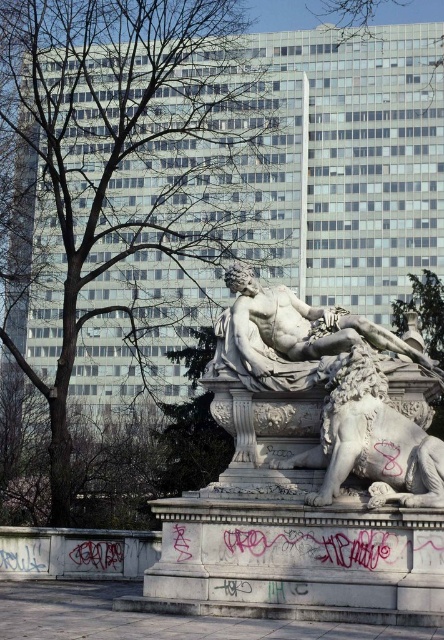
Question: Which point is farther from the camera taking this photo?

Choices:
 (A) (71, 324)
 (B) (288, 316)
 (C) (341, 442)

Answer: (A)

Question: Does white marble lion at lower center appear under white marble statue at center?

Choices:
 (A) yes
 (B) no

Answer: (A)

Question: Considering the real-world distances, which object is farthest from the white marble statue at center?

Choices:
 (A) white marble lion at lower center
 (B) green leafy tree at center

Answer: (B)

Question: Can you confirm if green leafy tree at center is wider than white marble statue at center?

Choices:
 (A) yes
 (B) no

Answer: (A)

Question: Does green leafy tree at center appear on the right side of white marble statue at center?

Choices:
 (A) yes
 (B) no

Answer: (B)

Question: Which point is farther from the camera taking this photo?

Choices:
 (A) (298, 356)
 (B) (47, 164)
 (C) (376, 396)

Answer: (B)